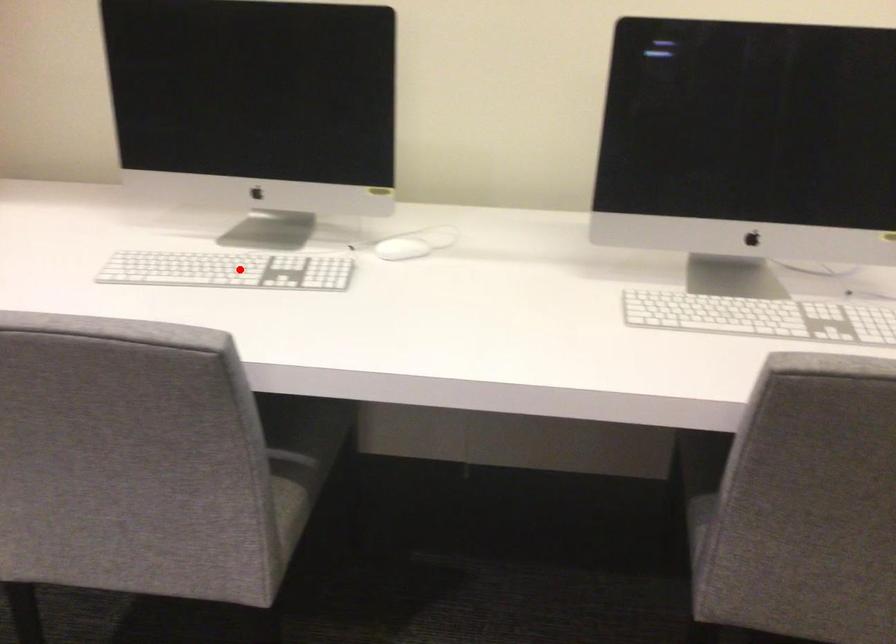
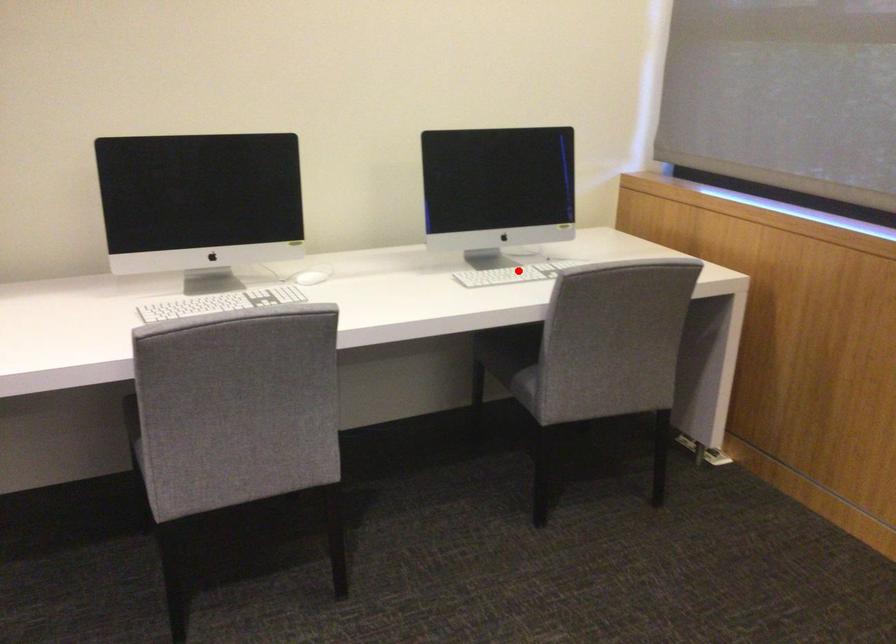
I am providing you with two images of the same scene from different viewpoints. A red point is marked on the first image and another point is marked on the second image. Are the points marked in image1 and image2 representing the same 3D position?

No